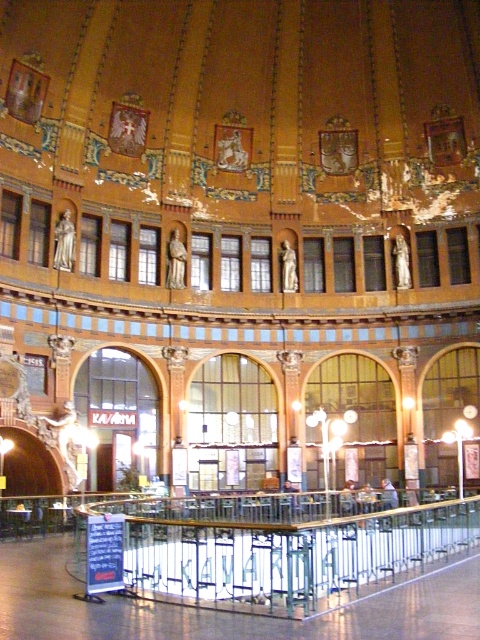
Is metallic glass balustrade at center thinner than golden statue at center?

In fact, metallic glass balustrade at center might be wider than golden statue at center.

In the scene shown: Between metallic glass balustrade at center and golden statue at center, which one appears on the right side from the viewer's perspective?

Positioned to the right is metallic glass balustrade at center.

Is point (372, 554) farther from camera compared to point (183, 243)?

No, (372, 554) is in front of (183, 243).

The image size is (480, 640). What are the coordinates of `metallic glass balustrade at center` in the screenshot? It's located at (279, 554).

Which of these two, metallic glass balustrade at center or matte gold statue at center, stands taller?

Standing taller between the two is metallic glass balustrade at center.

Identify the location of metallic glass balustrade at center. (279, 554).

Can you confirm if metallic glass balustrade at center is positioned below polished bronze statue at upper left?

Yes, metallic glass balustrade at center is below polished bronze statue at upper left.

Between point (397, 564) and point (66, 269), which one is positioned in front?

Point (397, 564) is more forward.

The image size is (480, 640). Identify the location of metallic glass balustrade at center. (279, 554).

In order to click on metallic glass balustrade at center in this screenshot , I will do [x=279, y=554].